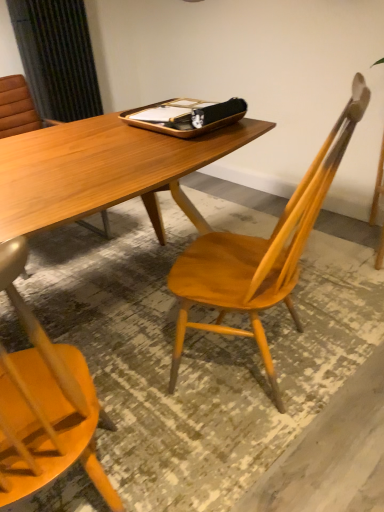
The height and width of the screenshot is (512, 384). Identify the location of vacant area that is in front of wooden tray at center. (163, 153).